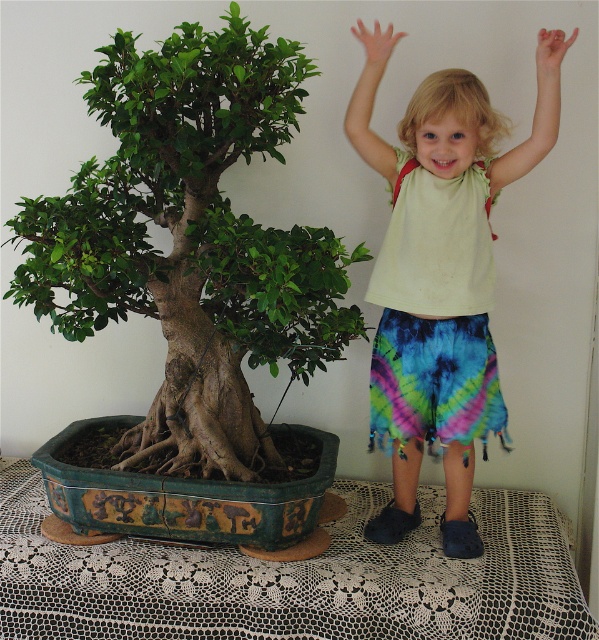
Question: Which object is closer to the camera taking this photo?

Choices:
 (A) green leafy bonsai at left
 (B) light yellow cotton shirt at upper center

Answer: (A)

Question: Among these points, which one is nearest to the camera?

Choices:
 (A) (435, 202)
 (B) (122, 320)

Answer: (A)

Question: Is green leafy bonsai at left below light yellow cotton shirt at upper center?

Choices:
 (A) no
 (B) yes

Answer: (A)

Question: Is the position of green leafy bonsai at left more distant than that of light yellow cotton shirt at upper center?

Choices:
 (A) yes
 (B) no

Answer: (B)

Question: Which point is closer to the camera?

Choices:
 (A) light yellow cotton shirt at upper center
 (B) green leafy bonsai at left

Answer: (B)

Question: Is green leafy bonsai at left in front of light yellow cotton shirt at upper center?

Choices:
 (A) yes
 (B) no

Answer: (A)